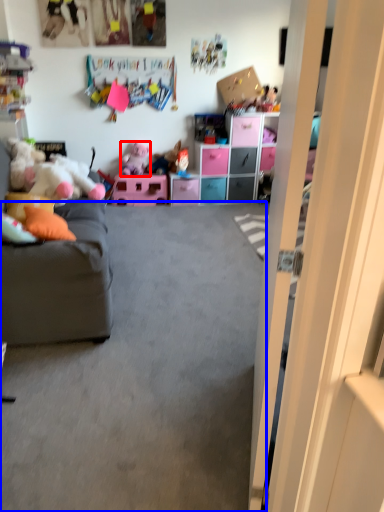
Question: Which object appears closest to the camera in this image, toy (highlighted by a red box) or plain (highlighted by a blue box)?

Choices:
 (A) toy
 (B) plain

Answer: (B)